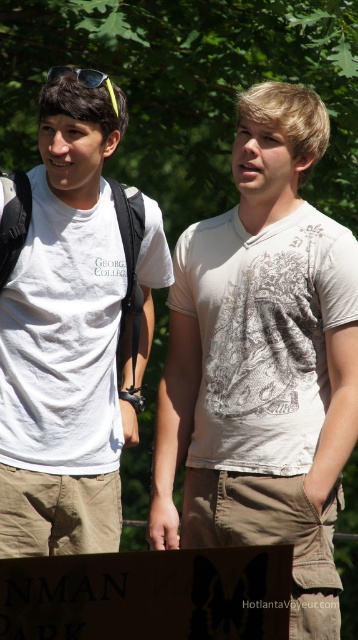
You are a photographer trying to capture a candid shot of the two people in the scene. Since you want to ensure the white cotton shirt at center and the sunglassestransparent at left are both clearly visible in the frame, which object should you focus on first to ensure proper depth of field?

You should focus on the white cotton shirt at center first because it is larger in size than the sunglassestransparent at left, ensuring it will be in focus while the smaller object may still be within the depth of field range.